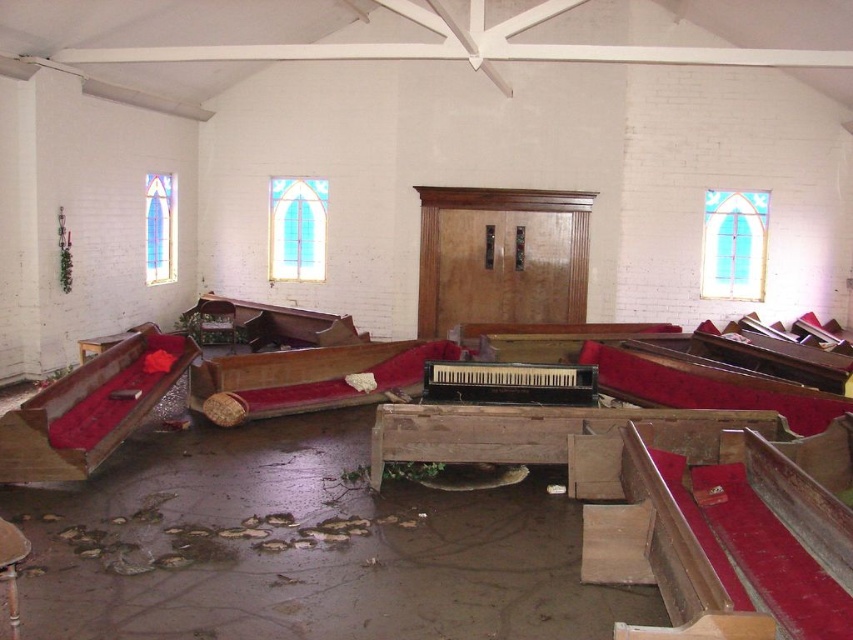
You are a maintenance worker assessing the interior of an abandoned church. You notice the wooden polished bench at left and the white painted wood beam at upper center. Which object is taller?

The wooden polished bench at left is taller than the white painted wood beam at upper center.

You are standing in the abandoned church and want to take a photo of both point (61,420) and point (132,60) in the scene. Which point should you focus on first to ensure both are in clear view?

You should focus on point (61,420) first because it is closer to the camera than point (132,60), ensuring both points will be in focus when using depth of field.